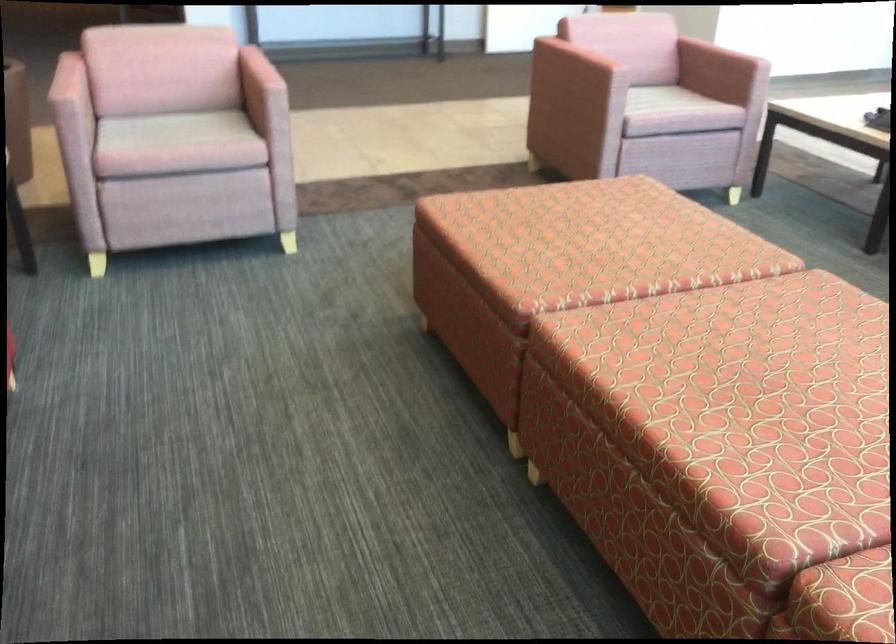
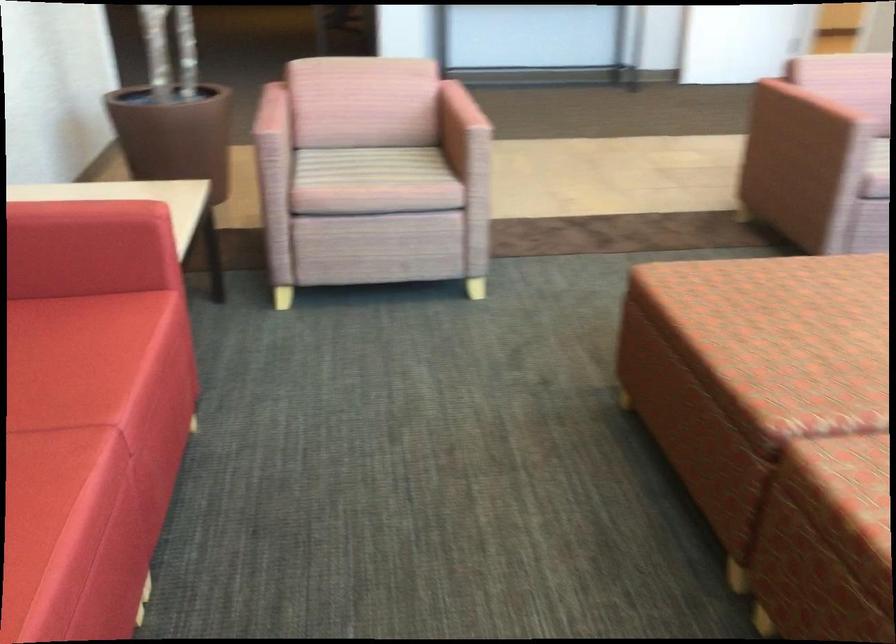
Locate, in the second image, the point that corresponds to point (166, 131) in the first image.

(365, 166)